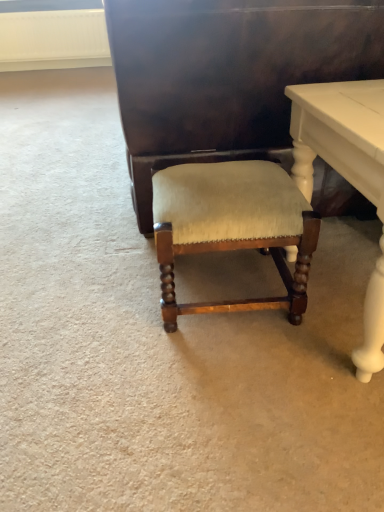
Question: From the image's perspective, relative to white glossy table at lower right, is suede-like beige cushion at center above or below?

Choices:
 (A) above
 (B) below

Answer: (B)

Question: From a real-world perspective, relative to white glossy table at lower right, is suede-like beige cushion at center vertically above or below?

Choices:
 (A) below
 (B) above

Answer: (A)

Question: Considering the real-world distances, which object is farthest from the shiny dark wood vanity at center?

Choices:
 (A) suede-like beige cushion at center
 (B) white glossy table at lower right

Answer: (A)

Question: Based on their relative distances, which object is nearer to the shiny dark wood vanity at center?

Choices:
 (A) suede-like beige cushion at center
 (B) white glossy table at lower right

Answer: (B)